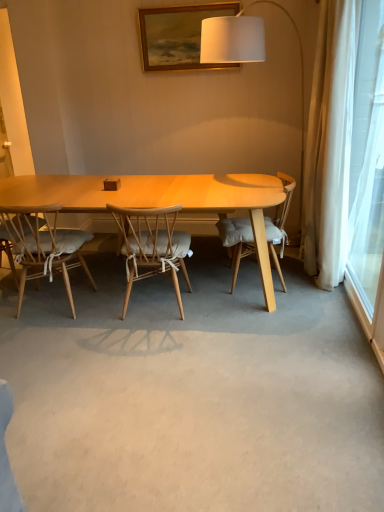
Locate an element on the screen. vacant area that lies between natural wood chair with cushion at center, which is the 2th chair from right to left, and light wood chair with white cushion at left, which is the first chair in left-to-right order is located at coordinates (101, 306).